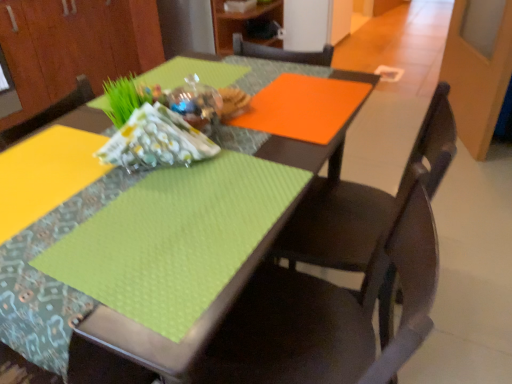
Question: Should I look upward or downward to see matte wood cabinet at upper left, the second cabinetry positioned from the right?

Choices:
 (A) up
 (B) down

Answer: (A)

Question: Does patterned fabric at center have a lesser width compared to matte black chair at center, the first chair from the back?

Choices:
 (A) no
 (B) yes

Answer: (B)

Question: Is patterned fabric at center completely or partially outside of matte black chair at center, which is the second chair from front to back?

Choices:
 (A) no
 (B) yes

Answer: (B)

Question: Does patterned fabric at center have a lesser height compared to matte black chair at center, which is the second chair from front to back?

Choices:
 (A) yes
 (B) no

Answer: (A)

Question: Are patterned fabric at center and matte black chair at center, which is the second chair from front to back, located far from each other?

Choices:
 (A) yes
 (B) no

Answer: (B)

Question: Is patterned fabric at center at the left side of matte black chair at center, the first chair from the back?

Choices:
 (A) yes
 (B) no

Answer: (A)

Question: Does patterned fabric at center have a smaller size compared to matte black chair at center, which is the second chair from front to back?

Choices:
 (A) yes
 (B) no

Answer: (A)

Question: Is matte wood cabinet at upper center, which appears as the 2th cabinetry when viewed from the left, wider than matte black chair at center, the first chair from the back?

Choices:
 (A) no
 (B) yes

Answer: (B)

Question: Is matte wood cabinet at upper center, which appears as the 2th cabinetry when viewed from the left, taller than matte black chair at center, the first chair from the back?

Choices:
 (A) no
 (B) yes

Answer: (A)

Question: From a real-world perspective, is matte wood cabinet at upper center, which appears as the 2th cabinetry when viewed from the left, below matte black chair at center, the first chair from the back?

Choices:
 (A) no
 (B) yes

Answer: (A)

Question: Is matte wood cabinet at upper center, which appears as the 2th cabinetry when viewed from the left, located outside matte black chair at center, which is the second chair from front to back?

Choices:
 (A) no
 (B) yes

Answer: (B)

Question: Is matte wood cabinet at upper center, which appears as the first cabinetry when viewed from the right, directly adjacent to matte black chair at center, which is the second chair from front to back?

Choices:
 (A) yes
 (B) no

Answer: (B)

Question: Considering the relative positions of matte wood cabinet at upper center, which appears as the first cabinetry when viewed from the right, and matte black chair at center, the first chair from the back, in the image provided, is matte wood cabinet at upper center, which appears as the first cabinetry when viewed from the right, to the left of matte black chair at center, the first chair from the back, from the viewer's perspective?

Choices:
 (A) yes
 (B) no

Answer: (A)

Question: Considering the relative sizes of matte wood cabinet at upper left, the second cabinetry positioned from the right, and matte wood cabinet at upper center, which appears as the 2th cabinetry when viewed from the left, in the image provided, is matte wood cabinet at upper left, the second cabinetry positioned from the right, shorter than matte wood cabinet at upper center, which appears as the 2th cabinetry when viewed from the left,?

Choices:
 (A) no
 (B) yes

Answer: (A)